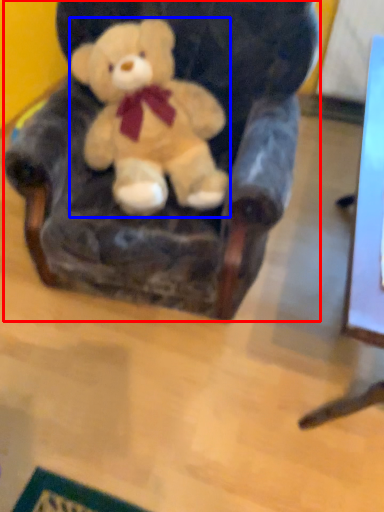
Question: Which of the following is the farthest to the observer, armchair (highlighted by a red box) or teddy bear (highlighted by a blue box)?

Choices:
 (A) armchair
 (B) teddy bear

Answer: (B)